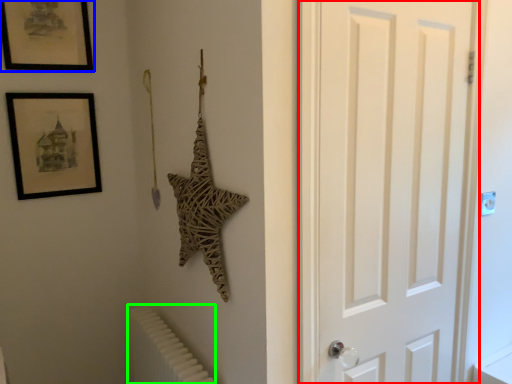
Question: Which is farther away from door (highlighted by a red box)? picture frame (highlighted by a blue box) or radiator (highlighted by a green box)?

Choices:
 (A) picture frame
 (B) radiator

Answer: (A)